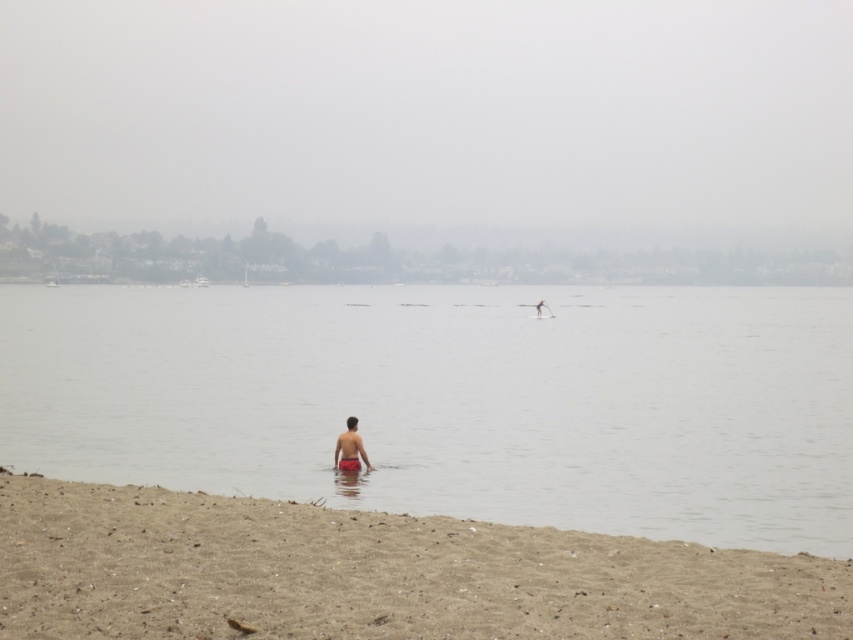
Question: Which object appears farthest from the camera in this image?

Choices:
 (A) brown sandy beach at lower left
 (B) clear water at center
 (C) reddish-orange swim trunks at center

Answer: (C)

Question: Which point is closer to the camera?

Choices:
 (A) (363, 449)
 (B) (329, 589)

Answer: (B)

Question: Considering the relative positions of clear water at center and brown sandy beach at lower left in the image provided, where is clear water at center located with respect to brown sandy beach at lower left?

Choices:
 (A) left
 (B) right

Answer: (A)

Question: Considering the relative positions of brown sandy beach at lower left and reddish-orange swim trunks at center in the image provided, where is brown sandy beach at lower left located with respect to reddish-orange swim trunks at center?

Choices:
 (A) right
 (B) left

Answer: (A)

Question: Does brown sandy beach at lower left appear over reddish-orange swim trunks at center?

Choices:
 (A) no
 (B) yes

Answer: (A)

Question: Which of the following is the farthest from the observer?

Choices:
 (A) brown sandy beach at lower left
 (B) clear water at center
 (C) reddish-orange swim trunks at center

Answer: (C)